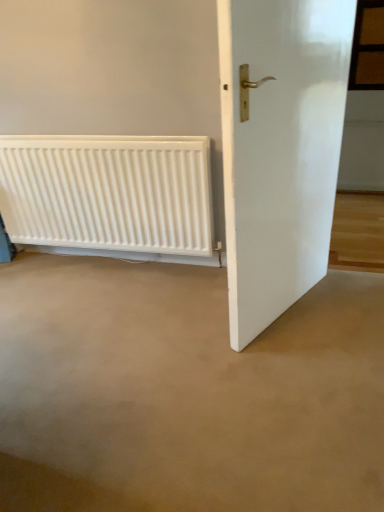
What do you see at coordinates (368, 47) in the screenshot?
I see `brown wooden window at upper right` at bounding box center [368, 47].

Where is `brown wooden window at upper right`? The width and height of the screenshot is (384, 512). brown wooden window at upper right is located at coordinates (368, 47).

Which object is closer to the camera taking this photo, brown wooden window at upper right or white glossy door at right?

white glossy door at right is more forward.

Is brown wooden window at upper right directly adjacent to white glossy door at right?

No, brown wooden window at upper right is not beside white glossy door at right.

Would you say brown wooden window at upper right is outside white glossy door at right?

brown wooden window at upper right is positioned outside white glossy door at right.

Considering the sizes of white glossy door at right and brown wooden window at upper right in the image, is white glossy door at right bigger or smaller than brown wooden window at upper right?

In the image, white glossy door at right appears to be larger than brown wooden window at upper right.

Considering the relative positions of white glossy door at right and brown wooden window at upper right in the image provided, is white glossy door at right to the right of brown wooden window at upper right from the viewer's perspective?

No, white glossy door at right is not to the right of brown wooden window at upper right.

Where is `window above the white glossy door at right (from the image's perspective)`? The height and width of the screenshot is (512, 384). window above the white glossy door at right (from the image's perspective) is located at coordinates (368, 47).

Considering the relative positions of white glossy door at right and brown wooden window at upper right in the image provided, is white glossy door at right behind brown wooden window at upper right?

No.

Between point (74, 206) and point (247, 220), which one is positioned behind?

The point (74, 206) is farther from the camera.

In the scene shown: From a real-world perspective, relative to white glossy door at right, is white matte radiator at lower left vertically above or below?

In terms of real-world spatial position, white matte radiator at lower left is below white glossy door at right.

Can we say white matte radiator at lower left lies outside white glossy door at right?

Yes.

Is white matte radiator at lower left turned away from white glossy door at right?

No.

Between white glossy door at right and white matte radiator at lower left, which one has less height?

Standing shorter between the two is white matte radiator at lower left.

From a real-world perspective, who is located lower, white glossy door at right or white matte radiator at lower left?

white matte radiator at lower left.

Based on the photo, is white glossy door at right looking in the opposite direction of white matte radiator at lower left?

Yes.

Is white glossy door at right in contact with white matte radiator at lower left?

No, white glossy door at right is not touching white matte radiator at lower left.

Are white matte radiator at lower left and brown wooden window at upper right located far from each other?

That's right, there is a large distance between white matte radiator at lower left and brown wooden window at upper right.

From the image's perspective, does white matte radiator at lower left appear higher than brown wooden window at upper right?

No, from the image's perspective, white matte radiator at lower left is not on top of brown wooden window at upper right.

Which is behind, white matte radiator at lower left or brown wooden window at upper right?

brown wooden window at upper right is further from the camera.

Which is behind, point (34, 182) or point (376, 15)?

The point (376, 15) is farther.

How far apart are brown wooden window at upper right and white matte radiator at lower left?

1.76 meters.

Considering the relative sizes of brown wooden window at upper right and white matte radiator at lower left in the image provided, is brown wooden window at upper right thinner than white matte radiator at lower left?

Correct, the width of brown wooden window at upper right is less than that of white matte radiator at lower left.

Between brown wooden window at upper right and white matte radiator at lower left, which one is positioned in front?

white matte radiator at lower left.

Is brown wooden window at upper right not within white matte radiator at lower left?

Yes, brown wooden window at upper right is not within white matte radiator at lower left.

The image size is (384, 512). In order to click on door to the left of brown wooden window at upper right in this screenshot , I will do `click(280, 149)`.

Where is `window above the white glossy door at right (from a real-world perspective)`? window above the white glossy door at right (from a real-world perspective) is located at coordinates (368, 47).

Which object lies further to the anchor point white glossy door at right, brown wooden window at upper right or white matte radiator at lower left?

Based on the image, brown wooden window at upper right appears to be further to white glossy door at right.

Looking at the image, which one is located further to brown wooden window at upper right, white glossy door at right or white matte radiator at lower left?

Based on the image, white matte radiator at lower left appears to be further to brown wooden window at upper right.

From the image, which object appears to be farther from white matte radiator at lower left, brown wooden window at upper right or white glossy door at right?

brown wooden window at upper right.

Based on their spatial positions, is white matte radiator at lower left or brown wooden window at upper right further from white glossy door at right?

brown wooden window at upper right is positioned further to the anchor white glossy door at right.

From the image, which object appears to be nearer to brown wooden window at upper right, white matte radiator at lower left or white glossy door at right?

white glossy door at right is positioned closer to the anchor brown wooden window at upper right.

Which object lies further to the anchor point white matte radiator at lower left, white glossy door at right or brown wooden window at upper right?

brown wooden window at upper right lies further to white matte radiator at lower left than the other object.

Image resolution: width=384 pixels, height=512 pixels. I want to click on door located between white matte radiator at lower left and brown wooden window at upper right in the left-right direction, so click(280, 149).